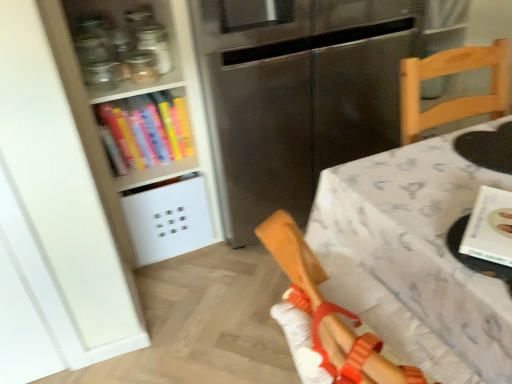
Question: From the image's perspective, does stainless steel fridge at center appear lower than wooden chair at right?

Choices:
 (A) yes
 (B) no

Answer: (B)

Question: Is stainless steel fridge at center far away from wooden chair at right?

Choices:
 (A) no
 (B) yes

Answer: (A)

Question: Could wooden chair at right be considered to be inside stainless steel fridge at center?

Choices:
 (A) no
 (B) yes

Answer: (A)

Question: Is stainless steel fridge at center bigger than wooden chair at right?

Choices:
 (A) no
 (B) yes

Answer: (B)

Question: Are stainless steel fridge at center and wooden chair at right beside each other?

Choices:
 (A) yes
 (B) no

Answer: (B)

Question: Considering their positions, is stainless steel fridge at center located in front of or behind transparent glass jar at upper left?

Choices:
 (A) front
 (B) behind

Answer: (A)

Question: Looking at the image, does stainless steel fridge at center seem bigger or smaller compared to transparent glass jar at upper left?

Choices:
 (A) small
 (B) big

Answer: (B)

Question: In terms of height, does stainless steel fridge at center look taller or shorter compared to transparent glass jar at upper left?

Choices:
 (A) short
 (B) tall

Answer: (B)

Question: In the image, is stainless steel fridge at center on the left side or the right side of transparent glass jar at upper left?

Choices:
 (A) right
 (B) left

Answer: (A)

Question: Looking at their shapes, would you say white paper book at right, positioned as the second book in back-to-front order, is wider or thinner than hardcover book at upper left, marked as the 2th book in a front-to-back arrangement?

Choices:
 (A) wide
 (B) thin

Answer: (B)

Question: Would you say white paper book at right, positioned as the 1th book in front-to-back order, is to the left or to the right of hardcover book at upper left, which appears as the 1th book when viewed from the left, in the picture?

Choices:
 (A) left
 (B) right

Answer: (B)

Question: From the image's perspective, is white paper book at right, acting as the 1th book starting from the right, above or below hardcover book at upper left, marked as the 2th book in a front-to-back arrangement?

Choices:
 (A) below
 (B) above

Answer: (A)

Question: Is white paper book at right, placed as the 2th book when sorted from top to bottom, spatially inside hardcover book at upper left, marked as the 2th book in a front-to-back arrangement, or outside of it?

Choices:
 (A) outside
 (B) inside

Answer: (A)

Question: From their relative heights in the image, would you say hardcover book at upper left, which is counted as the 2th book, starting from the bottom, is taller or shorter than stainless steel fridge at center?

Choices:
 (A) tall
 (B) short

Answer: (B)

Question: Is hardcover book at upper left, which is counted as the 1th book, starting from the top, wider or thinner than stainless steel fridge at center?

Choices:
 (A) thin
 (B) wide

Answer: (A)